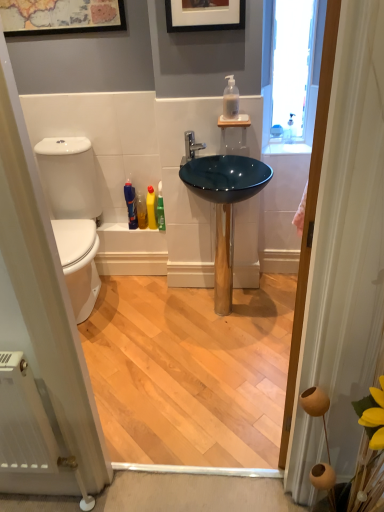
Question: Considering the relative sizes of wooden door at right and polished chrome faucet at center in the image provided, is wooden door at right shorter than polished chrome faucet at center?

Choices:
 (A) no
 (B) yes

Answer: (A)

Question: Is wooden door at right not within polished chrome faucet at center?

Choices:
 (A) yes
 (B) no

Answer: (A)

Question: Is there a large distance between wooden door at right and polished chrome faucet at center?

Choices:
 (A) yes
 (B) no

Answer: (A)

Question: Is polished chrome faucet at center a part of wooden door at right?

Choices:
 (A) no
 (B) yes

Answer: (A)

Question: Can you confirm if wooden door at right is taller than polished chrome faucet at center?

Choices:
 (A) no
 (B) yes

Answer: (B)

Question: Does wooden door at right have a lesser width compared to polished chrome faucet at center?

Choices:
 (A) no
 (B) yes

Answer: (B)

Question: Considering the relative sizes of transparent glass window at upper right and green glossy bottle at center, the 1th toiletry from the right, in the image provided, is transparent glass window at upper right smaller than green glossy bottle at center, the 1th toiletry from the right,?

Choices:
 (A) yes
 (B) no

Answer: (B)

Question: Is transparent glass window at upper right to the right of green glossy bottle at center, which is the 4th toiletry from left to right, from the viewer's perspective?

Choices:
 (A) yes
 (B) no

Answer: (A)

Question: Can you confirm if transparent glass window at upper right is wider than green glossy bottle at center, which is the 4th toiletry from left to right?

Choices:
 (A) no
 (B) yes

Answer: (A)

Question: From a real-world perspective, does transparent glass window at upper right stand above green glossy bottle at center, the 1th toiletry from the right?

Choices:
 (A) no
 (B) yes

Answer: (B)

Question: Is transparent glass window at upper right not within green glossy bottle at center, which is the 4th toiletry from left to right?

Choices:
 (A) no
 (B) yes

Answer: (B)

Question: Is transparent glass window at upper right next to green glossy bottle at center, which is the 4th toiletry from left to right, and touching it?

Choices:
 (A) yes
 (B) no

Answer: (B)

Question: Is yellow plastic bottle at lower center, the 3th toiletry positioned from the left, smaller than polished chrome faucet at center?

Choices:
 (A) yes
 (B) no

Answer: (A)